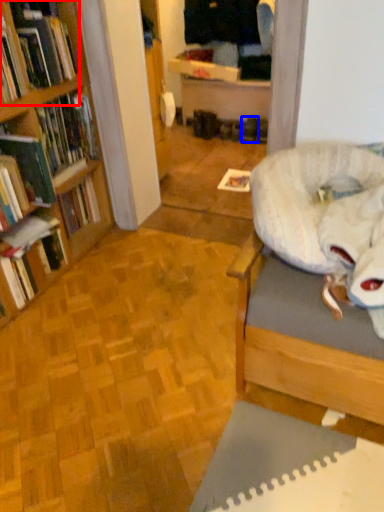
Question: Which point is closer to the camera, book (highlighted by a red box) or footwear (highlighted by a blue box)?

Choices:
 (A) book
 (B) footwear

Answer: (A)